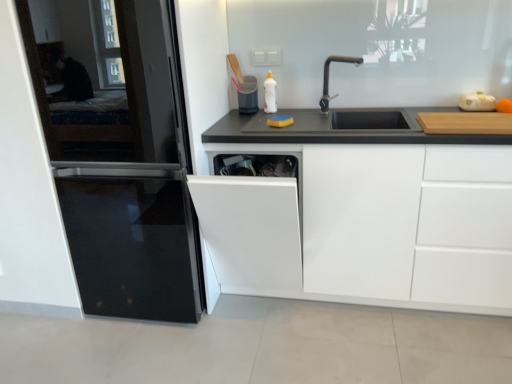
The image size is (512, 384). Find the location of `white plastic cutting board at upper right, which is counted as the second appliance, starting from the back`. white plastic cutting board at upper right, which is counted as the second appliance, starting from the back is located at coordinates (477, 102).

What is the approximate width of white glossy bottle at upper center?

The width of white glossy bottle at upper center is 4.53 inches.

The height and width of the screenshot is (384, 512). In order to click on white matte cabinet at center in this screenshot , I will do `click(366, 226)`.

What do you see at coordinates (465, 122) in the screenshot? The height and width of the screenshot is (384, 512). I see `wooden cutting board at right` at bounding box center [465, 122].

What do you see at coordinates (129, 179) in the screenshot? I see `black glass refrigerator at left` at bounding box center [129, 179].

Measure the distance between black glass refrigerator at left and camera.

black glass refrigerator at left and camera are 5.09 feet apart from each other.

Where is `white plastic cutting board at upper right, which is the 1th appliance from front to back`? The height and width of the screenshot is (384, 512). white plastic cutting board at upper right, which is the 1th appliance from front to back is located at coordinates (477, 102).

Which of these two, black glass refrigerator at left or wooden cutting board at right, is bigger?

With larger size is black glass refrigerator at left.

Which is in front, point (127, 83) or point (503, 134)?

The point (503, 134) is closer to the camera.

From a real-world perspective, who is located lower, black glass refrigerator at left or wooden cutting board at right?

black glass refrigerator at left is physically lower.

Between black glass refrigerator at left and wooden cutting board at right, which one appears on the left side from the viewer's perspective?

black glass refrigerator at left is more to the left.

Considering the sizes of objects white matte cabinet at center and white plastic cutting board at upper right, marked as the first appliance in a right-to-left arrangement, in the image provided, who is thinner, white matte cabinet at center or white plastic cutting board at upper right, marked as the first appliance in a right-to-left arrangement,?

With smaller width is white plastic cutting board at upper right, marked as the first appliance in a right-to-left arrangement.

Who is shorter, white matte cabinet at center or white plastic cutting board at upper right, which is the 1th appliance from front to back?

white plastic cutting board at upper right, which is the 1th appliance from front to back, is shorter.

Is white matte cabinet at center in front of or behind white plastic cutting board at upper right, marked as the first appliance in a right-to-left arrangement, in the image?

Clearly, white matte cabinet at center is in front of white plastic cutting board at upper right, marked as the first appliance in a right-to-left arrangement.

Would you say white matte cabinet at center is a long distance from white plastic cutting board at upper right, the second appliance in the left-to-right sequence?

No, white matte cabinet at center is in close proximity to white plastic cutting board at upper right, the second appliance in the left-to-right sequence.

Is white matte cabinet at center oriented towards black metallic faucet at upper center?

No, white matte cabinet at center is not aimed at black metallic faucet at upper center.

Consider the image. From a real-world perspective, which object stands above the other?

black metallic faucet at upper center.

From the picture: Between white matte cabinet at center and black metallic faucet at upper center, which one has more height?

With more height is white matte cabinet at center.

Between white matte cabinet at center and black metallic faucet at upper center, which one has larger width?

white matte cabinet at center.

Between point (35, 76) and point (271, 106), which one is positioned behind?

Point (271, 106)

Is black glass refrigerator at left bigger than white glossy bottle at upper center?

Yes, black glass refrigerator at left is bigger than white glossy bottle at upper center.

Is black glass refrigerator at left at the right side of white glossy bottle at upper center?

No.

Consider the image. Choose the correct answer: Is black glass refrigerator at left inside white glossy bottle at upper center or outside it?

black glass refrigerator at left is spatially situated outside white glossy bottle at upper center.

Would you say wooden cutting board at right is a long distance from matte plastic trash can at center, the second appliance from the front?

wooden cutting board at right is positioned a significant distance from matte plastic trash can at center, the second appliance from the front.

In the image, is wooden cutting board at right on the left side or the right side of matte plastic trash can at center, the 1th appliance positioned from the back?

wooden cutting board at right is to the right of matte plastic trash can at center, the 1th appliance positioned from the back.

Does wooden cutting board at right turn towards matte plastic trash can at center, the 1th appliance positioned from the back?

No, wooden cutting board at right is not aimed at matte plastic trash can at center, the 1th appliance positioned from the back.

Considering the relative sizes of wooden cutting board at right and matte plastic trash can at center, which is the 1th appliance in left-to-right order, in the image provided, is wooden cutting board at right bigger than matte plastic trash can at center, which is the 1th appliance in left-to-right order,?

Indeed, wooden cutting board at right has a larger size compared to matte plastic trash can at center, which is the 1th appliance in left-to-right order.

Between white glossy dishwasher at center and matte plastic trash can at center, which is the 1th appliance in left-to-right order, which one has smaller size?

matte plastic trash can at center, which is the 1th appliance in left-to-right order, is smaller.

Which of these two, white glossy dishwasher at center or matte plastic trash can at center, which is the 2th appliance from right to left, is thinner?

With smaller width is matte plastic trash can at center, which is the 2th appliance from right to left.

In the image, is white glossy dishwasher at center positioned in front of or behind matte plastic trash can at center, the 1th appliance positioned from the back?

Clearly, white glossy dishwasher at center is in front of matte plastic trash can at center, the 1th appliance positioned from the back.

Is white glossy dishwasher at center next to matte plastic trash can at center, which is the 2th appliance from right to left?

No, white glossy dishwasher at center is not next to matte plastic trash can at center, which is the 2th appliance from right to left.

Is white plastic cutting board at upper right, the second appliance in the left-to-right sequence, aimed at white glossy bottle at upper center?

No, white plastic cutting board at upper right, the second appliance in the left-to-right sequence, is not facing towards white glossy bottle at upper center.

Would you say white plastic cutting board at upper right, marked as the first appliance in a right-to-left arrangement, is to the left or to the right of white glossy bottle at upper center in the picture?

Clearly, white plastic cutting board at upper right, marked as the first appliance in a right-to-left arrangement, is on the right of white glossy bottle at upper center in the image.

Is white plastic cutting board at upper right, marked as the first appliance in a right-to-left arrangement, far from white glossy bottle at upper center?

They are positioned close to each other.

The image size is (512, 384). I want to click on cutting board that is behind the black glass refrigerator at left, so click(x=465, y=122).

Identify the location of cabinetry below the white plastic cutting board at upper right, marked as the first appliance in a right-to-left arrangement (from a real-world perspective). This screenshot has height=384, width=512. (366, 226).

When comparing their distances from wooden cutting board at right, does matte plastic trash can at center, which is the 1th appliance in left-to-right order, or white matte cabinet at center seem closer?

Among the two, white matte cabinet at center is located nearer to wooden cutting board at right.

Based on their spatial positions, is matte plastic trash can at center, which is the 2th appliance from right to left, or white plastic cutting board at upper right, marked as the first appliance in a right-to-left arrangement, closer to black metallic faucet at upper center?

Among the two, matte plastic trash can at center, which is the 2th appliance from right to left, is located nearer to black metallic faucet at upper center.

Consider the image. Looking at the image, which one is located further to black glass refrigerator at left, white glossy dishwasher at center or white matte cabinet at center?

white matte cabinet at center is positioned further to the anchor black glass refrigerator at left.

Based on their spatial positions, is white glossy bottle at upper center or black metallic faucet at upper center further from white plastic cutting board at upper right, the second appliance in the left-to-right sequence?

Among the two, white glossy bottle at upper center is located further to white plastic cutting board at upper right, the second appliance in the left-to-right sequence.

Estimate the real-world distances between objects in this image. Which object is further from white matte cabinet at center, white glossy dishwasher at center or matte plastic trash can at center, the second appliance from the front?

matte plastic trash can at center, the second appliance from the front, lies further to white matte cabinet at center than the other object.

Estimate the real-world distances between objects in this image. Which object is closer to wooden cutting board at right, black metallic faucet at upper center or white matte cabinet at center?

white matte cabinet at center is positioned closer to the anchor wooden cutting board at right.

From the image, which object appears to be farther from white glossy dishwasher at center, matte plastic trash can at center, the 1th appliance positioned from the back, or wooden cutting board at right?

wooden cutting board at right is positioned further to the anchor white glossy dishwasher at center.

When comparing their distances from white glossy dishwasher at center, does white matte cabinet at center or matte plastic trash can at center, the second appliance from the front, seem further?

matte plastic trash can at center, the second appliance from the front, is positioned further to the anchor white glossy dishwasher at center.

You are a GUI agent. You are given a task and a screenshot of the screen. Output one action in this format:
    pyautogui.click(x=<x>, y=<y>)
    Task: Click on the dish washer located between black glass refrigerator at left and black metallic faucet at upper center in the left-right direction
    Image resolution: width=512 pixels, height=384 pixels.
    Given the screenshot: What is the action you would take?
    pyautogui.click(x=248, y=234)

Where is `cutting board situated between matte plastic trash can at center, which is the 2th appliance from right to left, and white plastic cutting board at upper right, which is the 1th appliance from front to back, from left to right`? The width and height of the screenshot is (512, 384). cutting board situated between matte plastic trash can at center, which is the 2th appliance from right to left, and white plastic cutting board at upper right, which is the 1th appliance from front to back, from left to right is located at coordinates (465, 122).

At what (x,y) coordinates should I click in order to perform the action: click on tap that lies between white glossy bottle at upper center and white matte cabinet at center from top to bottom. Please return your answer as a coordinate pair (x, y). This screenshot has height=384, width=512. Looking at the image, I should click on (328, 78).

This screenshot has width=512, height=384. What are the coordinates of `bottle located between white matte cabinet at center and matte plastic trash can at center, the 1th appliance positioned from the back, in the depth direction` in the screenshot? It's located at (270, 94).